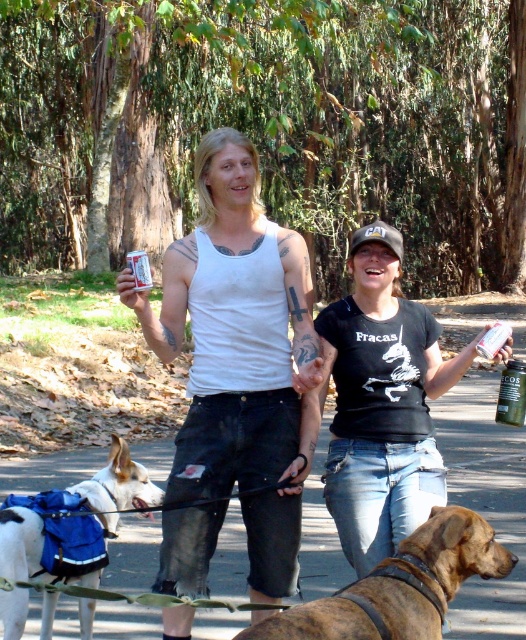
You are designing a new clothing line and want to ensure that the white cotton tank top at center can be worn comfortably over the white plastic can at center. Based on the image provided, will the tank top fit over the can?

The white cotton tank top at center has a smaller width than the white plastic can at center, so it would not fit over the can since the tank top is narrower.